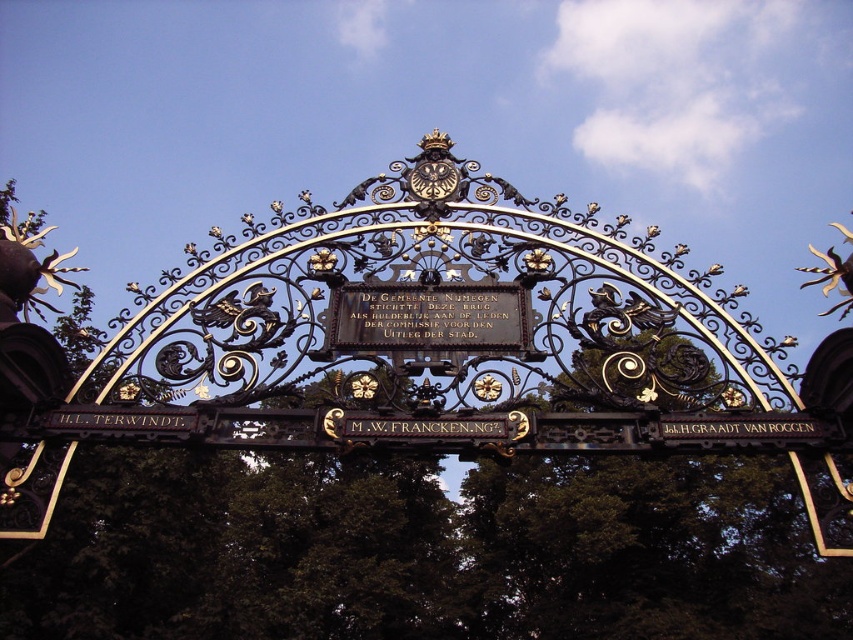
Question: Which object appears closest to the camera in this image?

Choices:
 (A) green leafy tree at center
 (B) black polished wood plaque at center

Answer: (A)

Question: Can you confirm if green leafy tree at center is smaller than black polished wood plaque at center?

Choices:
 (A) yes
 (B) no

Answer: (B)

Question: Can you confirm if green leafy tree at center is bigger than black polished wood plaque at center?

Choices:
 (A) yes
 (B) no

Answer: (A)

Question: Can you confirm if green leafy tree at center is positioned to the left of black polished wood plaque at center?

Choices:
 (A) no
 (B) yes

Answer: (B)

Question: Which point appears farthest from the camera in this image?

Choices:
 (A) (96, 572)
 (B) (457, 348)

Answer: (A)